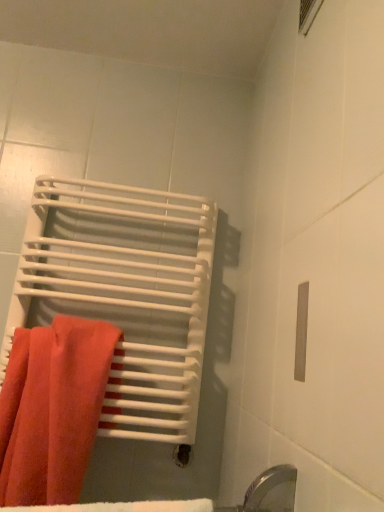
Question: Is matte white towel at left completely or partially outside of matte orange towel at left?

Choices:
 (A) no
 (B) yes

Answer: (B)

Question: Are matte white towel at left and matte orange towel at left far apart?

Choices:
 (A) yes
 (B) no

Answer: (B)

Question: Can you confirm if matte white towel at left is smaller than matte orange towel at left?

Choices:
 (A) no
 (B) yes

Answer: (A)

Question: Does matte white towel at left have a greater width compared to matte orange towel at left?

Choices:
 (A) yes
 (B) no

Answer: (A)

Question: Is matte white towel at left oriented away from matte orange towel at left?

Choices:
 (A) no
 (B) yes

Answer: (B)

Question: From the image's perspective, is matte white towel at left on top of matte orange towel at left?

Choices:
 (A) no
 (B) yes

Answer: (B)

Question: Does matte orange towel at left have a smaller size compared to matte white towel at left?

Choices:
 (A) no
 (B) yes

Answer: (B)

Question: From the image's perspective, is matte orange towel at left under matte white towel at left?

Choices:
 (A) no
 (B) yes

Answer: (B)

Question: Considering the relative positions of matte orange towel at left and matte white towel at left in the image provided, is matte orange towel at left to the left of matte white towel at left from the viewer's perspective?

Choices:
 (A) yes
 (B) no

Answer: (A)

Question: Can matte white towel at left be found inside matte orange towel at left?

Choices:
 (A) no
 (B) yes

Answer: (A)

Question: Is matte orange towel at left in front of matte white towel at left?

Choices:
 (A) yes
 (B) no

Answer: (A)

Question: Can we say matte orange towel at left lies outside matte white towel at left?

Choices:
 (A) no
 (B) yes

Answer: (A)

Question: Is matte orange towel at left wider or thinner than matte white towel at left?

Choices:
 (A) wide
 (B) thin

Answer: (B)